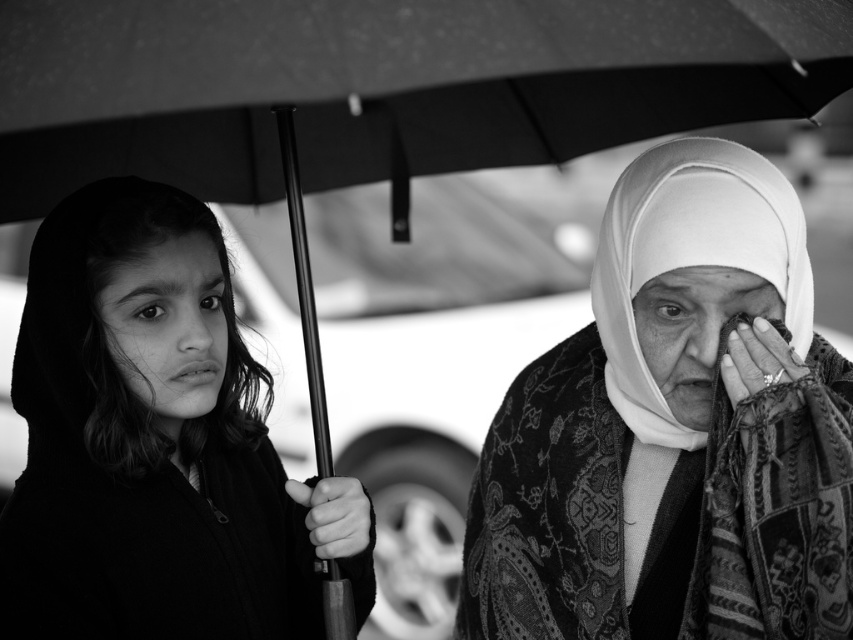
Who is more forward, (619, 403) or (759, 380)?

Point (759, 380) is more forward.

Find the location of a particular element. The width and height of the screenshot is (853, 640). white textured veil at right is located at coordinates (691, 257).

Which is behind, point (640, 388) or point (776, 348)?

The point (640, 388) is behind.

At what (x,y) coordinates should I click in order to perform the action: click on white textured veil at right. Please return your answer as a coordinate pair (x, y). This screenshot has height=640, width=853. Looking at the image, I should click on (691, 257).

Looking at this image, is smooth skin face at center further to the viewer compared to matte fabric face at center?

That is True.

Is smooth skin face at center below matte fabric face at center?

Actually, smooth skin face at center is above matte fabric face at center.

The width and height of the screenshot is (853, 640). I want to click on smooth skin face at center, so click(167, 324).

Is point (796, 326) less distant than point (194, 376)?

No, (796, 326) is further to viewer.

Between white textured veil at right and smooth skin face at center, which one is positioned lower?

smooth skin face at center

Is point (692, 164) positioned in front of point (196, 328)?

Yes, it is.

You are a GUI agent. You are given a task and a screenshot of the screen. Output one action in this format:
    pyautogui.click(x=<x>, y=<y>)
    Task: Click on the white textured veil at right
    The width and height of the screenshot is (853, 640).
    Given the screenshot: What is the action you would take?
    pyautogui.click(x=691, y=257)